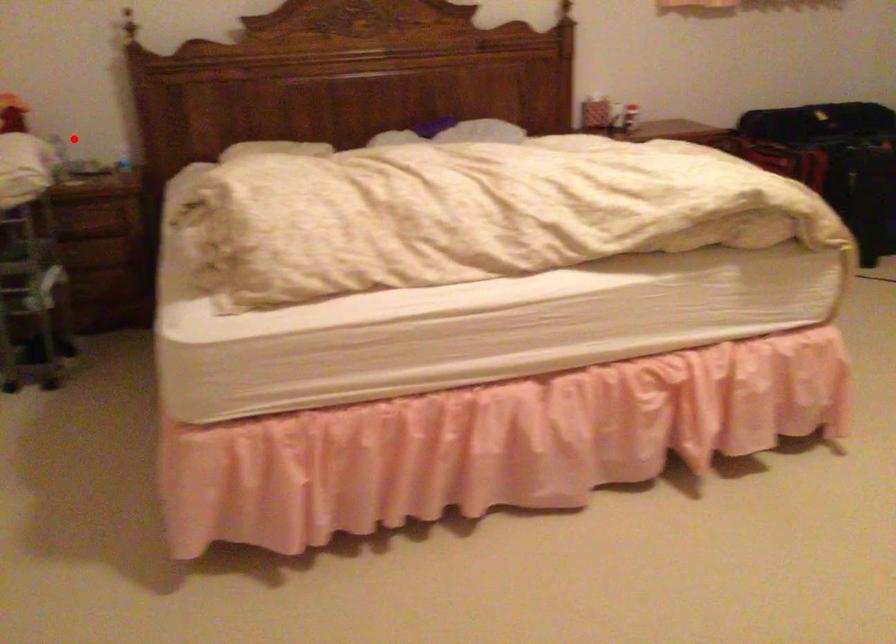
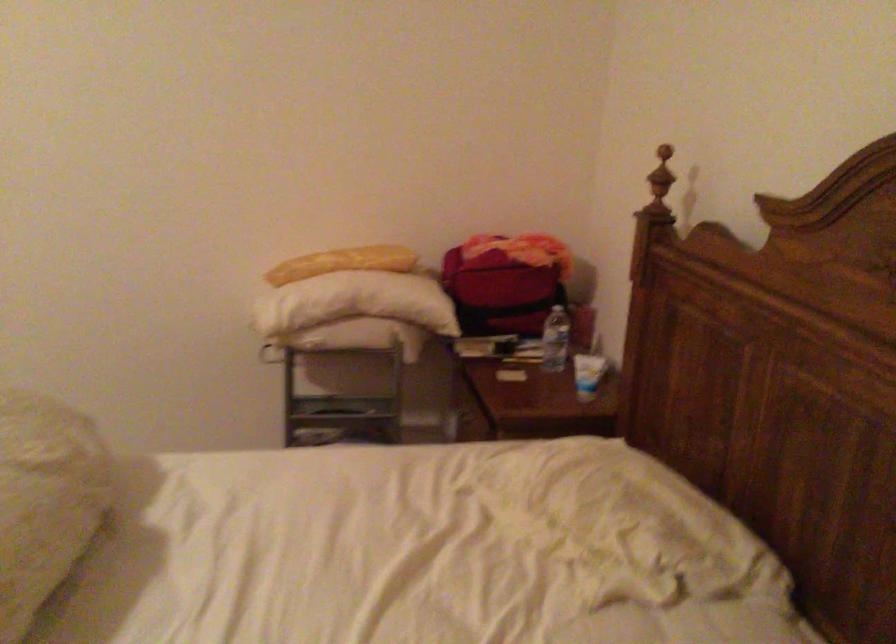
Question: I am providing you with two images of the same scene from different viewpoints. In image1, a red point is highlighted. Considering the same 3D point in image2, which of the following is correct?

Choices:
 (A) It is closer
 (B) It is farther

Answer: (A)